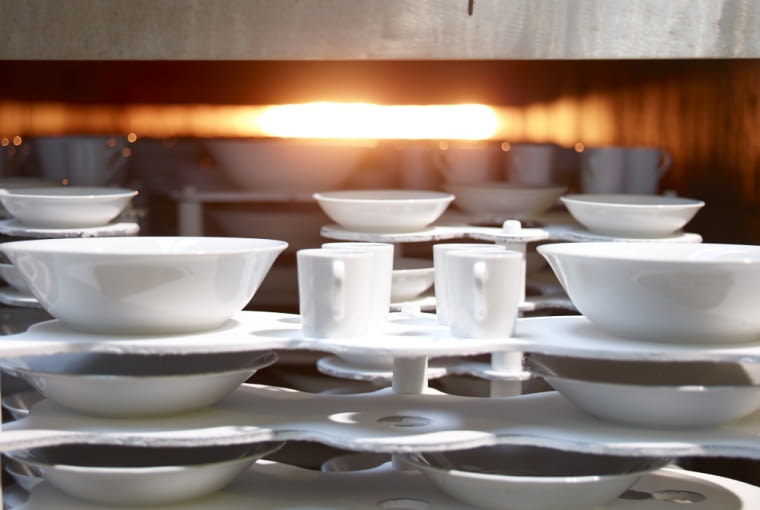
Where is `items on top nearest shelf`? The width and height of the screenshot is (760, 510). items on top nearest shelf is located at coordinates (157, 285), (382, 251), (359, 286), (476, 296), (435, 255), (628, 305).